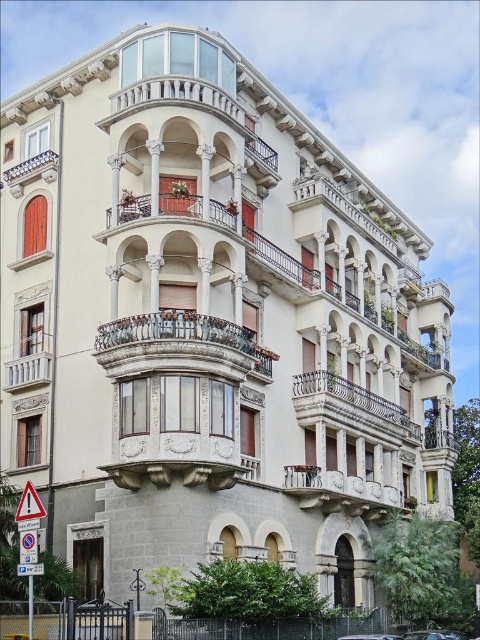
Is polished metal balcony at upper left to the right of shiny silver car at lower right from the viewer's perspective?

No, polished metal balcony at upper left is not to the right of shiny silver car at lower right.

Who is higher up, polished metal balcony at upper left or shiny silver car at lower right?

polished metal balcony at upper left is higher up.

Is point (32, 163) closer to camera compared to point (451, 636)?

No, it is behind (451, 636).

Locate an element on the screen. Image resolution: width=480 pixels, height=640 pixels. polished metal balcony at upper left is located at coordinates (32, 170).

The height and width of the screenshot is (640, 480). What do you see at coordinates (351, 406) in the screenshot?
I see `polished bronze railing at center` at bounding box center [351, 406].

Between polished bronze railing at center and yellow plastic triangle at lower left, which one appears on the right side from the viewer's perspective?

From the viewer's perspective, polished bronze railing at center appears more on the right side.

Between point (343, 422) and point (23, 508), which one is positioned in front?

Point (23, 508)

Where is `polished bronze railing at center`? This screenshot has height=640, width=480. polished bronze railing at center is located at coordinates (x=351, y=406).

Is point (44, 156) closer to camera compared to point (31, 502)?

No, (44, 156) is behind (31, 502).

Image resolution: width=480 pixels, height=640 pixels. I want to click on polished metal balcony at upper left, so click(32, 170).

Is point (11, 170) farther from camera compared to point (24, 502)?

Yes, it is behind point (24, 502).

Locate an element on the screen. The height and width of the screenshot is (640, 480). polished metal balcony at upper left is located at coordinates (32, 170).